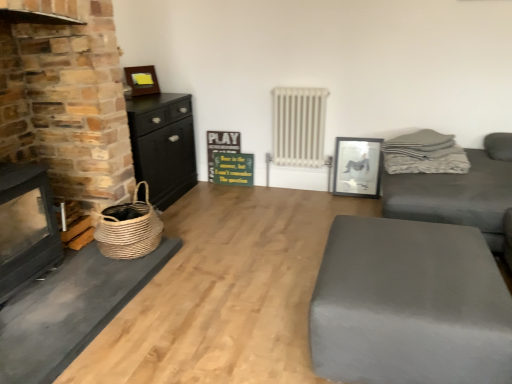
Describe the element at coordinates (130, 230) in the screenshot. This screenshot has width=512, height=384. I see `woven straw basket at left` at that location.

Where is `woven straw basket at left`? woven straw basket at left is located at coordinates (130, 230).

What do you see at coordinates (220, 147) in the screenshot? I see `green wooden signboard at center` at bounding box center [220, 147].

I want to click on black glossy picture frame at upper right, which ranks as the 2th picture frame in top-to-bottom order, so click(x=357, y=167).

Describe the element at coordinates (142, 80) in the screenshot. This screenshot has height=384, width=512. I see `wooden picture frame at upper left, placed as the 2th picture frame when sorted from right to left` at that location.

In order to face black wood chest of drawers at left, should I rotate leftwards or rightwards?

To align with it, rotate left about 14.408°.

From the picture: Measure the distance between brick fireplace at left and camera.

brick fireplace at left and camera are 1.50 meters apart from each other.

You are a GUI agent. You are given a task and a screenshot of the screen. Output one action in this format:
    pyautogui.click(x=<x>, y=<y>)
    Task: Click on the gray fabric couch at right
    Image resolution: width=512 pixels, height=384 pixels.
    Given the screenshot: What is the action you would take?
    pyautogui.click(x=459, y=193)

Can you confirm if woven straw basket at left is bigger than white metallic radiator at center?

No, woven straw basket at left is not bigger than white metallic radiator at center.

Would you consider woven straw basket at left to be distant from white metallic radiator at center?

woven straw basket at left is positioned a significant distance from white metallic radiator at center.

Is woven straw basket at left looking in the opposite direction of white metallic radiator at center?

No, woven straw basket at left's orientation is not away from white metallic radiator at center.

Considering the relative positions of woven straw basket at left and white metallic radiator at center in the image provided, is woven straw basket at left to the left or to the right of white metallic radiator at center?

woven straw basket at left is to the left of white metallic radiator at center.

From a real-world perspective, which object stands above the other?

brick fireplace at left, from a real-world perspective.

Between point (176, 154) and point (66, 270), which one is positioned behind?

Point (176, 154)

Does black wood chest of drawers at left have a greater width compared to brick fireplace at left?

In fact, black wood chest of drawers at left might be narrower than brick fireplace at left.

Which of these two, matte gray ottoman at lower right or gray fabric couch at right, stands taller?

Standing taller between the two is gray fabric couch at right.

The image size is (512, 384). Identify the location of table in front of the gray fabric couch at right. (409, 305).

From a real-world perspective, is matte gray ottoman at lower right located beneath gray fabric couch at right?

Correct, in the physical world, matte gray ottoman at lower right is lower than gray fabric couch at right.

Which is in front, matte gray ottoman at lower right or gray fabric couch at right?

matte gray ottoman at lower right.

Is white metallic radiator at center not inside black glossy picture frame at upper right, which is counted as the 1th picture frame, starting from the right?

That's correct, white metallic radiator at center is outside of black glossy picture frame at upper right, which is counted as the 1th picture frame, starting from the right.

Could you tell me if white metallic radiator at center is facing black glossy picture frame at upper right, which is counted as the 1th picture frame, starting from the right?

No.

Which is closer, (301, 142) or (355, 141)?

The point (355, 141) is closer to the camera.

Which of these two, white metallic radiator at center or black glossy picture frame at upper right, the second picture frame from the left, is bigger?

With larger size is white metallic radiator at center.

I want to click on basket on the left side of black glossy picture frame at upper right, which is counted as the 1th picture frame, starting from the right, so click(130, 230).

Could you tell me if woven straw basket at left is turned towards black glossy picture frame at upper right, arranged as the first picture frame when ordered from the bottom?

No, woven straw basket at left does not turn towards black glossy picture frame at upper right, arranged as the first picture frame when ordered from the bottom.

From the image's perspective, which one is positioned lower, woven straw basket at left or black glossy picture frame at upper right, which ranks as the 2th picture frame in top-to-bottom order?

woven straw basket at left is shown below in the image.

Looking at this image, does woven straw basket at left appear on the left side of black glossy picture frame at upper right, the second picture frame from the left?

Correct, you'll find woven straw basket at left to the left of black glossy picture frame at upper right, the second picture frame from the left.

Can you confirm if brick fireplace at left is wider than gray fabric couch at right?

In fact, brick fireplace at left might be narrower than gray fabric couch at right.

Which is more distant, [45,378] or [479,176]?

The point [479,176] is behind.

From the image's perspective, is brick fireplace at left above or below gray fabric couch at right?

Based on their image positions, brick fireplace at left is located beneath gray fabric couch at right.

From the image's perspective, is woven straw basket at left below black wood chest of drawers at left?

Yes.

Considering the relative positions of woven straw basket at left and black wood chest of drawers at left in the image provided, is woven straw basket at left behind black wood chest of drawers at left?

No, woven straw basket at left is closer to the camera.

Does point (137, 246) come closer to viewer compared to point (128, 117)?

Yes, it is in front of point (128, 117).

Is woven straw basket at left wider or thinner than black wood chest of drawers at left?

Clearly, woven straw basket at left has less width compared to black wood chest of drawers at left.

Where is `radiator positioned vertically above the woven straw basket at left (from a real-world perspective)`? The image size is (512, 384). radiator positioned vertically above the woven straw basket at left (from a real-world perspective) is located at coordinates pyautogui.click(x=298, y=126).

Locate an element on the screen. The height and width of the screenshot is (384, 512). chest of drawers that is on the right side of brick fireplace at left is located at coordinates (163, 145).

When comparing their distances from black glossy picture frame at upper right, the second picture frame from the left, does woven straw basket at left or green wooden signboard at center seem closer?

Based on the image, green wooden signboard at center appears to be nearer to black glossy picture frame at upper right, the second picture frame from the left.

Which object lies further to the anchor point black glossy picture frame at upper right, which is counted as the 1th picture frame, starting from the right, matte gray ottoman at lower right or white metallic radiator at center?

The object further to black glossy picture frame at upper right, which is counted as the 1th picture frame, starting from the right, is matte gray ottoman at lower right.

Looking at the image, which one is located closer to gray fabric couch at right, white metallic radiator at center or matte gray ottoman at lower right?

matte gray ottoman at lower right is positioned closer to the anchor gray fabric couch at right.

From the image, which object appears to be nearer to black wood chest of drawers at left, black glossy picture frame at upper right, which is counted as the 1th picture frame, starting from the right, or wooden picture frame at upper left, marked as the 2th picture frame in a bottom-to-top arrangement?

The object closer to black wood chest of drawers at left is wooden picture frame at upper left, marked as the 2th picture frame in a bottom-to-top arrangement.

From the image, which object appears to be farther from black wood chest of drawers at left, white metallic radiator at center or wooden picture frame at upper left, marked as the 2th picture frame in a bottom-to-top arrangement?

white metallic radiator at center lies further to black wood chest of drawers at left than the other object.

Based on their spatial positions, is woven straw basket at left or white metallic radiator at center further from green wooden signboard at center?

The object further to green wooden signboard at center is woven straw basket at left.

Which object lies nearer to the anchor point black glossy picture frame at upper right, which is counted as the 1th picture frame, starting from the right, white metallic radiator at center or woven straw basket at left?

The object closer to black glossy picture frame at upper right, which is counted as the 1th picture frame, starting from the right, is white metallic radiator at center.

Based on their spatial positions, is woven straw basket at left or wooden picture frame at upper left, which appears as the first picture frame when viewed from the top, further from black glossy picture frame at upper right, the second picture frame from the left?

wooden picture frame at upper left, which appears as the first picture frame when viewed from the top.

In order to click on bulletin board between black wood chest of drawers at left and white metallic radiator at center in this screenshot , I will do `click(220, 147)`.

This screenshot has height=384, width=512. What are the coordinates of `the chest of drawers located between matte gray ottoman at lower right and black glossy picture frame at upper right, which is counted as the 1th picture frame, starting from the right, in the depth direction` in the screenshot? It's located at (163, 145).

The height and width of the screenshot is (384, 512). I want to click on the chest of drawers located between brick fireplace at left and black glossy picture frame at upper right, which is counted as the 1th picture frame, starting from the right, in the depth direction, so click(x=163, y=145).

The width and height of the screenshot is (512, 384). Find the location of `table between brick fireplace at left and gray fabric couch at right`. table between brick fireplace at left and gray fabric couch at right is located at coordinates (409, 305).